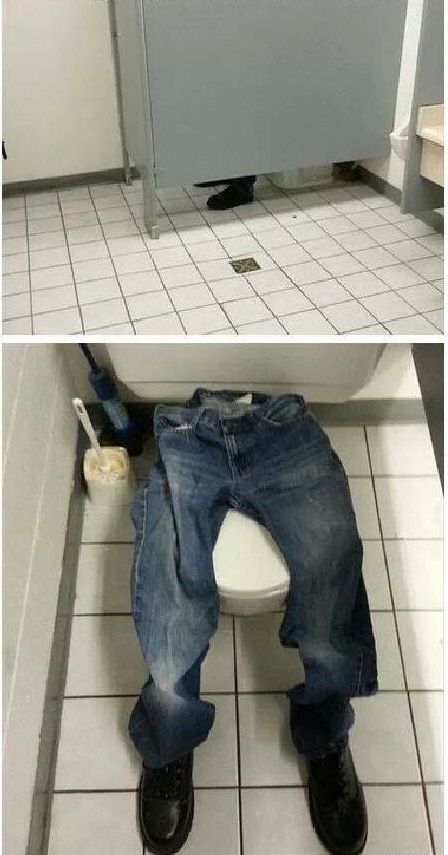
Identify the location of door. (131, 50).